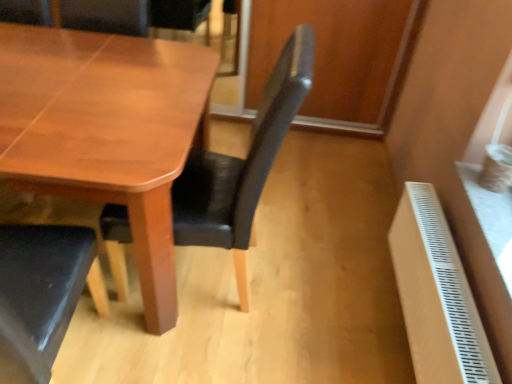
Where is `vacant space in white plastic radiator at lower right (from a real-world perspective)`? vacant space in white plastic radiator at lower right (from a real-world perspective) is located at coordinates (393, 325).